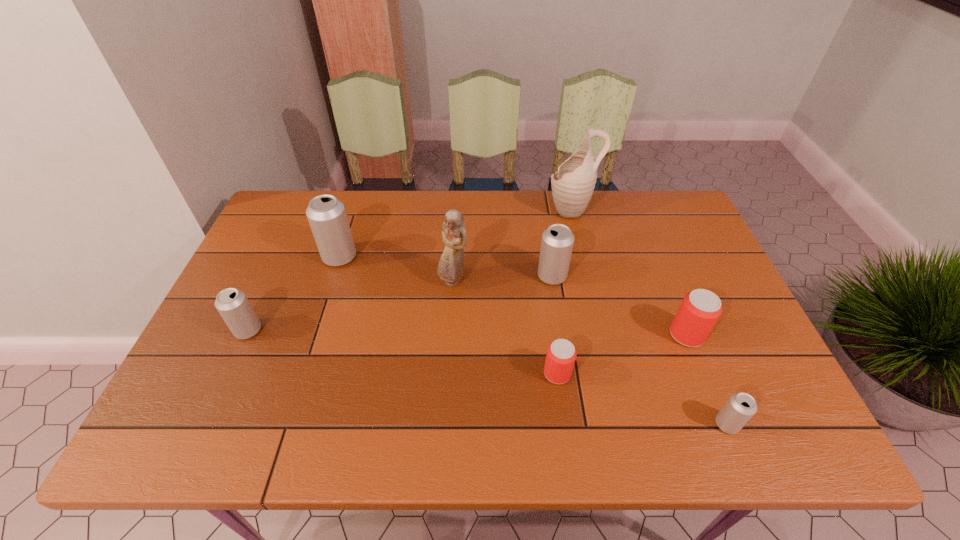
Where is `the leftmost white beer can`? the leftmost white beer can is located at coordinates (232, 304).

This screenshot has width=960, height=540. What are the coordinates of `the third farthest white beer can` in the screenshot? It's located at (232, 304).

At what (x,y) coordinates should I click in order to perform the action: click on the second nearest beer can. Please return your answer as a coordinate pair (x, y). The width and height of the screenshot is (960, 540). Looking at the image, I should click on (561, 354).

Locate an element on the screen. This screenshot has height=540, width=960. the nearer red beer can is located at coordinates (561, 354).

The width and height of the screenshot is (960, 540). Identify the location of the rightmost white beer can. (739, 409).

Find the location of a particular element. the nearest beer can is located at coordinates (739, 409).

Locate an element on the screen. The height and width of the screenshot is (540, 960). vacant space located at the spout of the pitcher is located at coordinates (429, 210).

This screenshot has height=540, width=960. Find the location of `vacant space located at the spout of the pitcher`. vacant space located at the spout of the pitcher is located at coordinates (508, 210).

Find the location of a particular element. The image size is (960, 540). vacant space located at the spout of the pitcher is located at coordinates (514, 210).

This screenshot has width=960, height=540. Find the location of `vacant space situated 0.180m on the front-facing side of the figurine`. vacant space situated 0.180m on the front-facing side of the figurine is located at coordinates (449, 347).